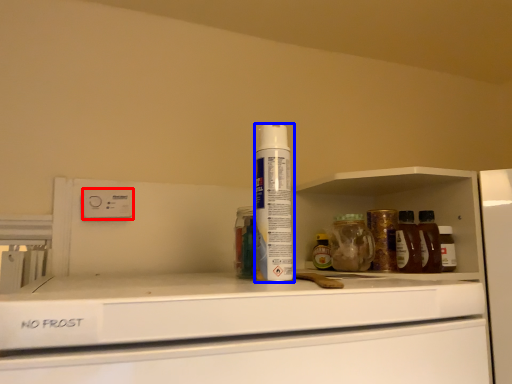
Question: Among these objects, which one is farthest to the camera, electric outlet (highlighted by a red box) or shaving cream (highlighted by a blue box)?

Choices:
 (A) electric outlet
 (B) shaving cream

Answer: (A)